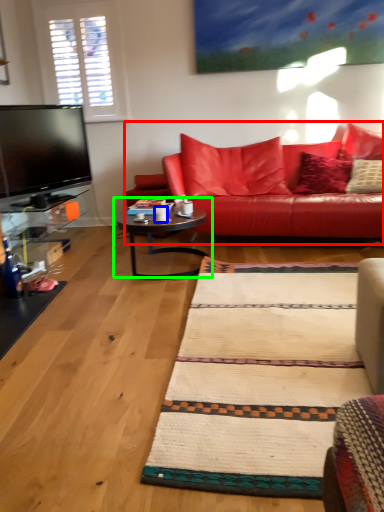
Question: Which object is the closest to the studio couch (highlighted by a red box)? Choose among these: coffee cup (highlighted by a blue box) or coffee table (highlighted by a green box).

Choices:
 (A) coffee cup
 (B) coffee table

Answer: (B)